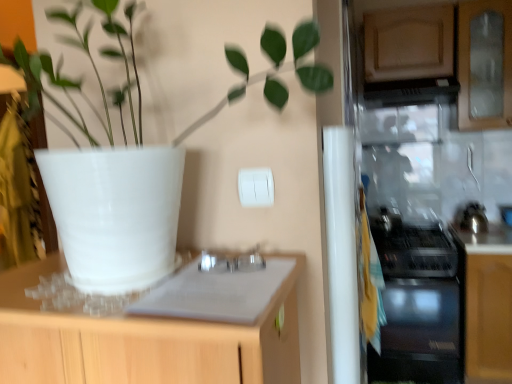
Question: From the image's perspective, does satin black oven at lower right appear higher than black glossy exhaust hood at upper right?

Choices:
 (A) yes
 (B) no

Answer: (B)

Question: Are satin black oven at lower right and black glossy exhaust hood at upper right making contact?

Choices:
 (A) yes
 (B) no

Answer: (B)

Question: Would you say satin black oven at lower right is a long distance from black glossy exhaust hood at upper right?

Choices:
 (A) yes
 (B) no

Answer: (A)

Question: From a real-world perspective, is satin black oven at lower right over black glossy exhaust hood at upper right?

Choices:
 (A) no
 (B) yes

Answer: (A)

Question: Is satin black oven at lower right facing away from black glossy exhaust hood at upper right?

Choices:
 (A) no
 (B) yes

Answer: (A)

Question: In the image, is white matte pot at upper left on the left side or the right side of satin black oven at lower right?

Choices:
 (A) left
 (B) right

Answer: (A)

Question: Is white matte pot at upper left bigger or smaller than satin black oven at lower right?

Choices:
 (A) big
 (B) small

Answer: (B)

Question: Is white matte pot at upper left taller or shorter than satin black oven at lower right?

Choices:
 (A) tall
 (B) short

Answer: (B)

Question: In the image, is white matte pot at upper left positioned in front of or behind satin black oven at lower right?

Choices:
 (A) behind
 (B) front

Answer: (B)

Question: Considering the positions of satin black oven at lower right and black glass gas stove at right in the image, is satin black oven at lower right taller or shorter than black glass gas stove at right?

Choices:
 (A) short
 (B) tall

Answer: (B)

Question: Is satin black oven at lower right inside the boundaries of black glass gas stove at right, or outside?

Choices:
 (A) outside
 (B) inside

Answer: (A)

Question: Would you say satin black oven at lower right is to the left or to the right of black glass gas stove at right in the picture?

Choices:
 (A) left
 (B) right

Answer: (A)

Question: From a real-world perspective, is satin black oven at lower right positioned above or below black glass gas stove at right?

Choices:
 (A) below
 (B) above

Answer: (A)

Question: Is white matte pot at upper left taller or shorter than black glass gas stove at right?

Choices:
 (A) tall
 (B) short

Answer: (A)

Question: Considering the positions of point (234, 43) and point (448, 258), is point (234, 43) closer or farther from the camera than point (448, 258)?

Choices:
 (A) farther
 (B) closer

Answer: (B)